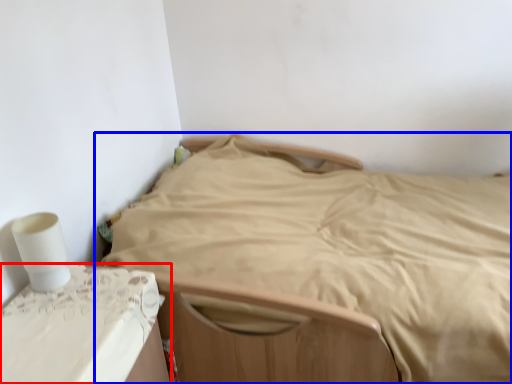
Question: Which of the following is the closest to the observer, furniture (highlighted by a red box) or bed (highlighted by a blue box)?

Choices:
 (A) furniture
 (B) bed

Answer: (A)